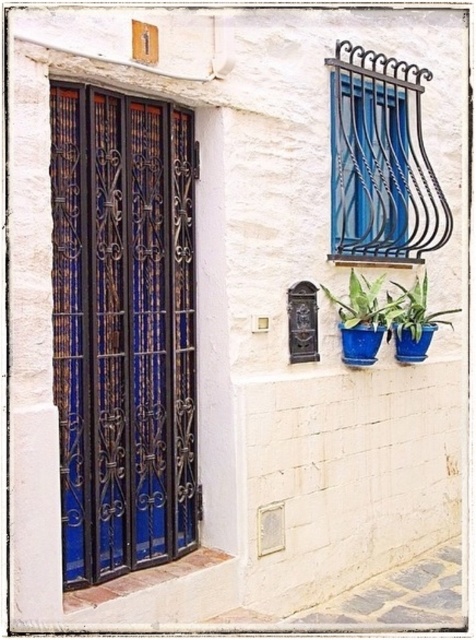
Question: Which point appears farthest from the camera in this image?

Choices:
 (A) (351, 324)
 (B) (171, 324)
 (C) (403, 252)
 (D) (423, 289)

Answer: (C)

Question: Which point appears farthest from the camera in this image?

Choices:
 (A) (73, 208)
 (B) (358, 304)

Answer: (B)

Question: Which point is closer to the camera taking this photo?

Choices:
 (A) (364, 316)
 (B) (426, 193)
 (C) (140, 253)

Answer: (C)

Question: Does blue matte metal door at left have a greater width compared to blue glossy pot at center?

Choices:
 (A) yes
 (B) no

Answer: (A)

Question: Does blue matte metal door at left appear on the right side of blue glossy pot at center?

Choices:
 (A) no
 (B) yes

Answer: (A)

Question: Can you confirm if wrought iron window frame at upper right is wider than blue glossy pot at center?

Choices:
 (A) no
 (B) yes

Answer: (B)